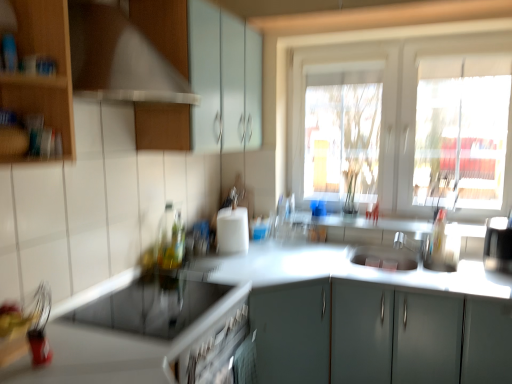
Question: Does translucent glass bottle at center, which ranks as the 2th bottle in back-to-front order, touch matte white cabinet at upper center, arranged as the 1th cabinetry when viewed from the top?

Choices:
 (A) yes
 (B) no

Answer: (B)

Question: From a real-world perspective, is translucent glass bottle at center, which ranks as the 2th bottle in back-to-front order, positioned over matte white cabinet at upper center, arranged as the 3th cabinetry when ordered from the bottom, based on gravity?

Choices:
 (A) yes
 (B) no

Answer: (B)

Question: Considering the relative sizes of translucent glass bottle at center, which ranks as the 2th bottle in back-to-front order, and matte white cabinet at upper center, which is the 2th cabinetry from left to right, in the image provided, is translucent glass bottle at center, which ranks as the 2th bottle in back-to-front order, bigger than matte white cabinet at upper center, which is the 2th cabinetry from left to right,?

Choices:
 (A) no
 (B) yes

Answer: (A)

Question: Considering the relative sizes of translucent glass bottle at center, which ranks as the 2th bottle in back-to-front order, and matte white cabinet at upper center, arranged as the 1th cabinetry when viewed from the top, in the image provided, is translucent glass bottle at center, which ranks as the 2th bottle in back-to-front order, shorter than matte white cabinet at upper center, arranged as the 1th cabinetry when viewed from the top,?

Choices:
 (A) no
 (B) yes

Answer: (B)

Question: Would you say translucent glass bottle at center, the 1th bottle viewed from the front, is outside matte white cabinet at upper center, which is the 2th cabinetry from left to right?

Choices:
 (A) yes
 (B) no

Answer: (A)

Question: Does translucent glass bottle at center, which ranks as the 2th bottle in back-to-front order, have a smaller size compared to matte white cabinet at upper center, arranged as the 1th cabinetry when viewed from the top?

Choices:
 (A) yes
 (B) no

Answer: (A)

Question: Could you tell me if sleek silver coffee machine at right is facing translucent glass bottle at center, marked as the first bottle in a back-to-front arrangement?

Choices:
 (A) yes
 (B) no

Answer: (B)

Question: Is sleek silver coffee machine at right positioned in front of translucent glass bottle at center, acting as the 2th bottle starting from the front?

Choices:
 (A) yes
 (B) no

Answer: (A)

Question: Can you confirm if sleek silver coffee machine at right is positioned to the left of translucent glass bottle at center, marked as the first bottle in a back-to-front arrangement?

Choices:
 (A) yes
 (B) no

Answer: (B)

Question: Is sleek silver coffee machine at right shorter than translucent glass bottle at center, marked as the first bottle in a back-to-front arrangement?

Choices:
 (A) yes
 (B) no

Answer: (A)

Question: From a real-world perspective, does sleek silver coffee machine at right sit lower than translucent glass bottle at center, marked as the first bottle in a back-to-front arrangement?

Choices:
 (A) yes
 (B) no

Answer: (A)

Question: Would you say sleek silver coffee machine at right is outside translucent glass bottle at center, marked as the first bottle in a back-to-front arrangement?

Choices:
 (A) yes
 (B) no

Answer: (A)

Question: Is silver metallic faucet at center in front of wooden cabinet at left, marked as the second cabinetry in a top-to-bottom arrangement?

Choices:
 (A) yes
 (B) no

Answer: (B)